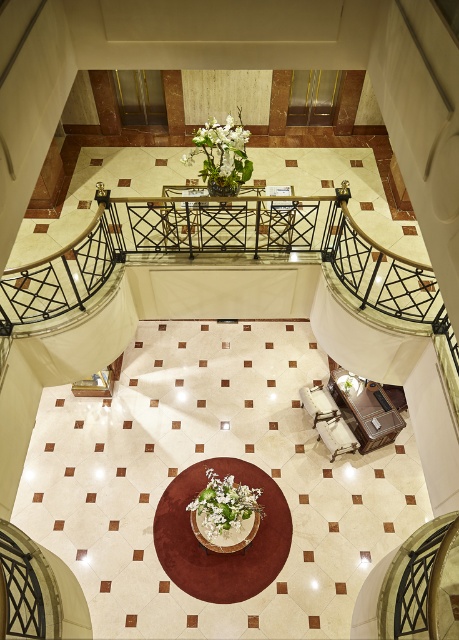
Identify the location of white matte flower at center. The image size is (459, 640). (224, 509).

Between white matte flower at center and white matte vase at center, which one appears on the left side from the viewer's perspective?

white matte flower at center is more to the left.

Is point (229, 483) positioned after point (196, 150)?

No, it is in front of (196, 150).

This screenshot has height=640, width=459. Identify the location of white matte flower at center. (224, 509).

Is white marble atrium at center further to camera compared to white matte flower at center?

Yes, it is behind white matte flower at center.

Which is below, white marble atrium at center or white matte flower at center?

Positioned lower is white matte flower at center.

This screenshot has width=459, height=640. What do you see at coordinates (207, 458) in the screenshot?
I see `white marble atrium at center` at bounding box center [207, 458].

Locate an element on the screen. The width and height of the screenshot is (459, 640). white marble atrium at center is located at coordinates (207, 458).

Does white marble atrium at center have a lesser height compared to white matte vase at center?

Yes.

From the picture: Can you confirm if white marble atrium at center is bigger than white matte vase at center?

Incorrect, white marble atrium at center is not larger than white matte vase at center.

Between point (402, 540) and point (241, 131), which one is positioned behind?

The point (402, 540) is behind.

This screenshot has height=640, width=459. Identify the location of white marble atrium at center. (207, 458).